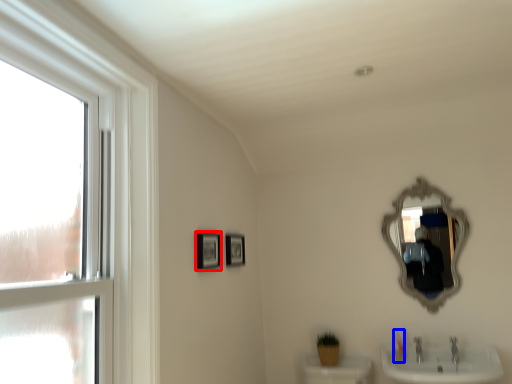
Question: Which point is further to the camera, picture frame (highlighted by a red box) or toiletry (highlighted by a blue box)?

Choices:
 (A) picture frame
 (B) toiletry

Answer: (B)